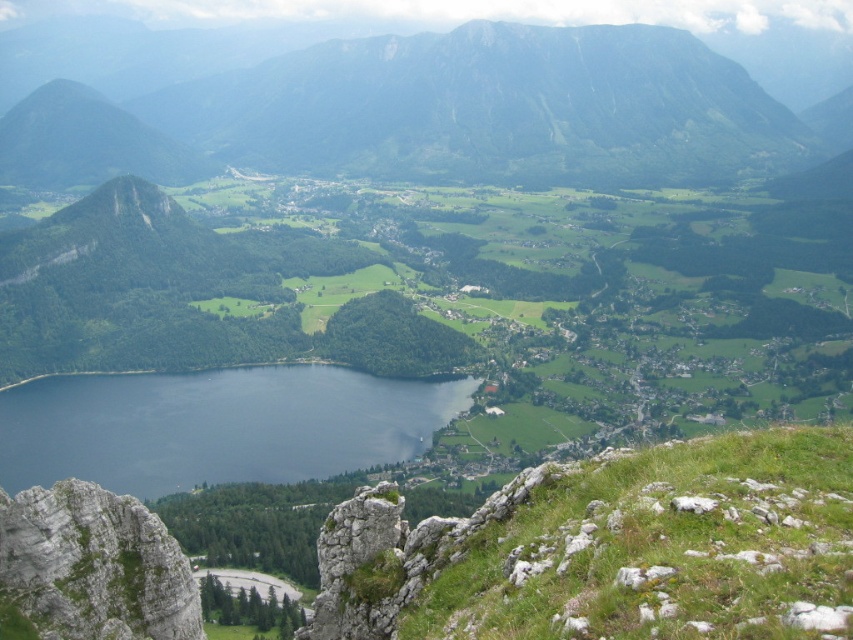
Describe the element at coordinates (490, 106) in the screenshot. I see `green grassy mountain at upper center` at that location.

Is green grassy mountain at upper center further to camera compared to dark blue water at center?

Yes.

What do you see at coordinates (490, 106) in the screenshot? This screenshot has width=853, height=640. I see `green grassy mountain at upper center` at bounding box center [490, 106].

This screenshot has height=640, width=853. Identify the location of green grassy mountain at upper center. (490, 106).